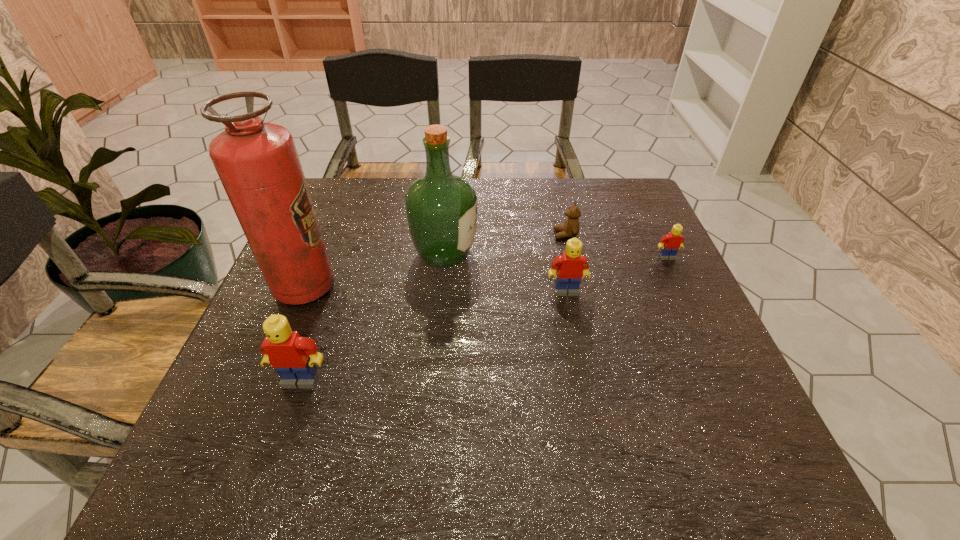
The height and width of the screenshot is (540, 960). Find the location of `the leftmost Lego`. the leftmost Lego is located at coordinates (293, 357).

Locate an element on the screen. This screenshot has width=960, height=540. the nearest object is located at coordinates (293, 357).

Locate an element on the screen. the fourth tallest object is located at coordinates (570, 266).

Where is `the second nearest Lego`? This screenshot has width=960, height=540. the second nearest Lego is located at coordinates (570, 266).

Where is `the rightmost Lego`? Image resolution: width=960 pixels, height=540 pixels. the rightmost Lego is located at coordinates (670, 243).

Find the location of `the farthest Lego`. the farthest Lego is located at coordinates tap(670, 243).

Image resolution: width=960 pixels, height=540 pixels. I want to click on the tallest object, so click(257, 162).

Where is `the second tallest object`? Image resolution: width=960 pixels, height=540 pixels. the second tallest object is located at coordinates (441, 207).

Locate an element on the screen. liquor is located at coordinates (441, 207).

This screenshot has width=960, height=540. In order to click on teddy bear in this screenshot , I will do `click(571, 226)`.